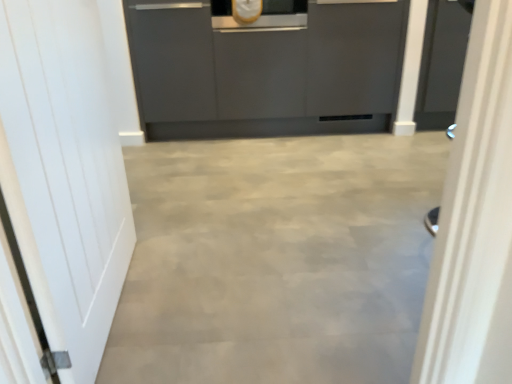
Question: Is matte gray cabinetry at center completely or partially inside white glossy door at right, the first door viewed from the right?

Choices:
 (A) no
 (B) yes

Answer: (A)

Question: Is white glossy door at right, the first door viewed from the right, closer to the viewer compared to matte gray cabinetry at center?

Choices:
 (A) yes
 (B) no

Answer: (A)

Question: From the image's perspective, is white glossy door at right, the first door viewed from the right, on matte gray cabinetry at center?

Choices:
 (A) no
 (B) yes

Answer: (A)

Question: Considering the relative sizes of white glossy door at right, which ranks as the second door in left-to-right order, and matte gray cabinetry at center in the image provided, is white glossy door at right, which ranks as the second door in left-to-right order, bigger than matte gray cabinetry at center?

Choices:
 (A) no
 (B) yes

Answer: (A)

Question: From a real-world perspective, is white glossy door at right, the first door viewed from the right, positioned over matte gray cabinetry at center based on gravity?

Choices:
 (A) yes
 (B) no

Answer: (B)

Question: From their relative heights in the image, would you say white matte door at left, the first door when ordered from left to right, is taller or shorter than matte gray cabinetry at center?

Choices:
 (A) tall
 (B) short

Answer: (A)

Question: In the image, is white matte door at left, the 2th door when ordered from right to left, positioned in front of or behind matte gray cabinetry at center?

Choices:
 (A) behind
 (B) front

Answer: (B)

Question: Does point (9, 102) appear closer or farther from the camera than point (148, 14)?

Choices:
 (A) farther
 (B) closer

Answer: (B)

Question: Do you think white matte door at left, the first door when ordered from left to right, is within matte gray cabinetry at center, or outside of it?

Choices:
 (A) outside
 (B) inside

Answer: (A)

Question: Do you think white glossy door at right, the first door viewed from the right, is within matte gray cabinetry at center, or outside of it?

Choices:
 (A) inside
 (B) outside

Answer: (B)

Question: Is white glossy door at right, the first door viewed from the right, in front of or behind matte gray cabinetry at center in the image?

Choices:
 (A) behind
 (B) front

Answer: (B)

Question: Based on their positions, is white glossy door at right, which ranks as the second door in left-to-right order, located to the left or right of matte gray cabinetry at center?

Choices:
 (A) right
 (B) left

Answer: (A)

Question: In terms of width, does white glossy door at right, which ranks as the second door in left-to-right order, look wider or thinner when compared to matte gray cabinetry at center?

Choices:
 (A) wide
 (B) thin

Answer: (B)

Question: Looking at the image, does matte gray cabinetry at center seem bigger or smaller compared to white glossy door at right, which ranks as the second door in left-to-right order?

Choices:
 (A) small
 (B) big

Answer: (B)

Question: Does point (335, 11) appear closer or farther from the camera than point (431, 345)?

Choices:
 (A) closer
 (B) farther

Answer: (B)